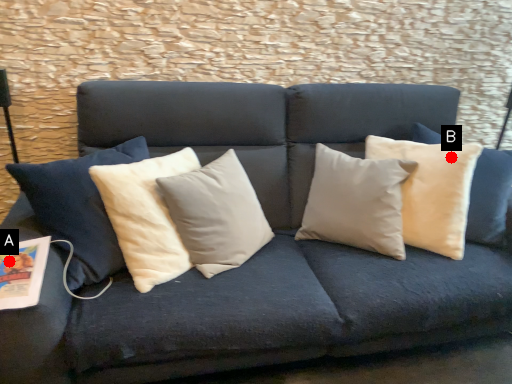
Question: Two points are circled on the image, labeled by A and B beside each circle. Which of the following is the closest to the observer?

Choices:
 (A) A is closer
 (B) B is closer

Answer: (A)